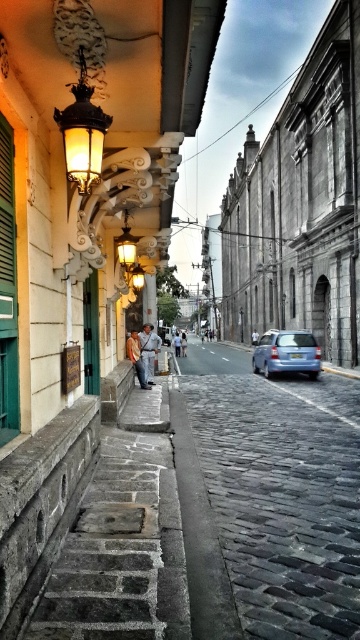
Between point (1, 253) and point (142, 326), which one is positioned in front?

Point (1, 253) is more forward.

Between point (2, 228) and point (147, 332), which one is positioned behind?

The point (147, 332) is more distant.

The image size is (360, 640). Identify the location of green painted wood shutter at left. (7, 291).

Does point (340, 560) lie behind point (7, 428)?

That is True.

Is point (258, 630) closer to camera compared to point (0, 268)?

Yes, point (258, 630) is closer to viewer.

Locate an element on the screen. cobblestone pavement at center is located at coordinates (267, 508).

Looking at this image, between blue matte car at center and denim jacket at center, which one is positioned higher?

denim jacket at center is above.

Does blue matte car at center appear on the left side of denim jacket at center?

In fact, blue matte car at center is to the right of denim jacket at center.

Where is `blue matte car at center`? This screenshot has width=360, height=640. blue matte car at center is located at coordinates (286, 353).